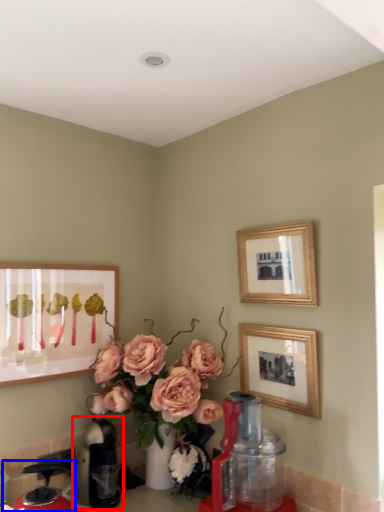
Question: Among these objects, which one is nearest to the camera, coffeepot (highlighted by a red box) or coffeepot (highlighted by a blue box)?

Choices:
 (A) coffeepot
 (B) coffeepot

Answer: (B)